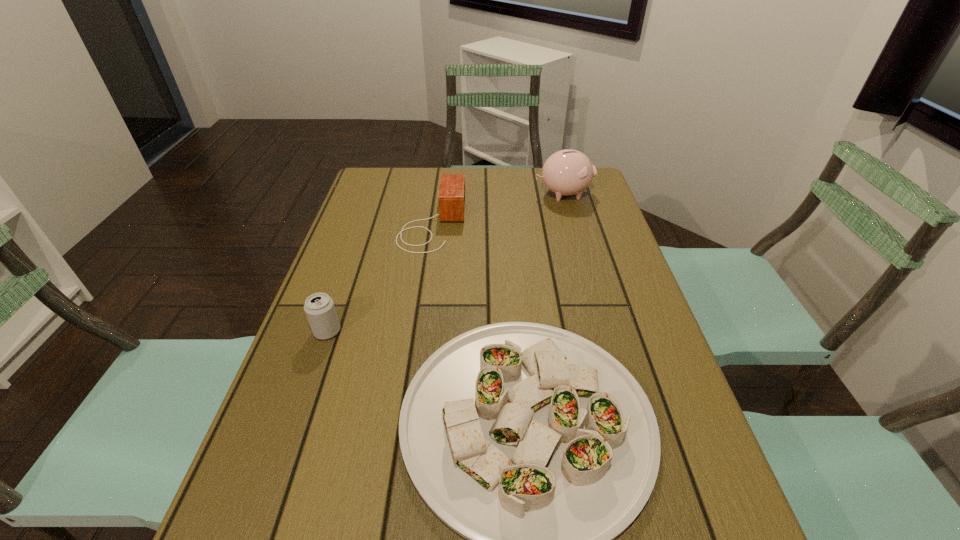
Locate an element on the screen. This screenshot has width=960, height=540. the tallest object is located at coordinates (567, 172).

The height and width of the screenshot is (540, 960). In order to click on the leftmost object in this screenshot , I will do `click(319, 308)`.

What are the coordinates of `radio receiver` in the screenshot? It's located at (451, 196).

Find the location of a particular element. This screenshot has width=960, height=540. free space located 0.240m on the left of the piggy bank is located at coordinates (x=461, y=193).

Locate an element on the screen. This screenshot has height=540, width=960. blank space located 0.120m on the back of the leftmost object is located at coordinates (343, 287).

Identify the location of free space located on the front-facing side of the radio receiver. (521, 224).

This screenshot has width=960, height=540. What are the coordinates of `piggy bank at the far edge` in the screenshot? It's located at (567, 172).

Image resolution: width=960 pixels, height=540 pixels. Identify the location of radio receiver present at the far edge. (451, 196).

In order to click on can situated at the left edge in this screenshot , I will do `click(319, 308)`.

Image resolution: width=960 pixels, height=540 pixels. I want to click on radio receiver that is at the left edge, so click(x=451, y=196).